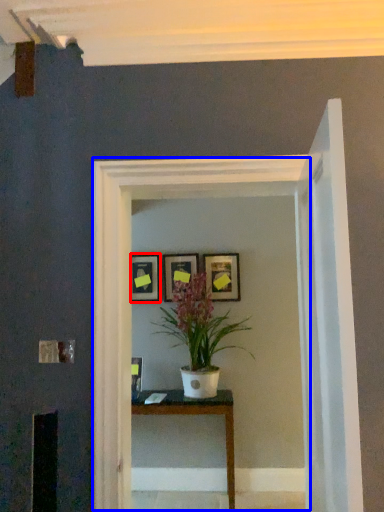
Question: Among these objects, which one is nearest to the camera, picture frame (highlighted by a red box) or glass door (highlighted by a blue box)?

Choices:
 (A) picture frame
 (B) glass door

Answer: (B)